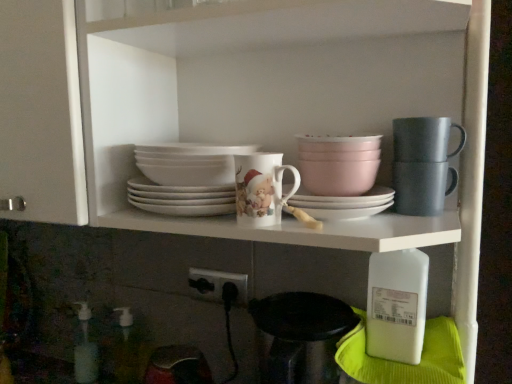
Question: From the image's perspective, would you say white matte platter at center is shown under matte gray mug at upper right, acting as the second tableware starting from the left?

Choices:
 (A) no
 (B) yes

Answer: (B)

Question: Is white matte platter at center bigger than matte gray mug at upper right, acting as the second tableware starting from the left?

Choices:
 (A) no
 (B) yes

Answer: (B)

Question: Are white matte platter at center and matte gray mug at upper right, acting as the second tableware starting from the left, located far from each other?

Choices:
 (A) yes
 (B) no

Answer: (B)

Question: Is white matte platter at center oriented away from matte gray mug at upper right, acting as the second tableware starting from the left?

Choices:
 (A) yes
 (B) no

Answer: (B)

Question: Would you say matte gray mug at upper right, arranged as the first tableware when viewed from the right, is part of white matte platter at center's contents?

Choices:
 (A) no
 (B) yes

Answer: (A)

Question: Does point (x=245, y=213) appear closer or farther from the camera than point (x=454, y=170)?

Choices:
 (A) closer
 (B) farther

Answer: (A)

Question: Do you think porcelain cup at center is within matte gray mug at upper right, or outside of it?

Choices:
 (A) outside
 (B) inside

Answer: (A)

Question: From the image's perspective, relative to matte gray mug at upper right, is porcelain cup at center above or below?

Choices:
 (A) above
 (B) below

Answer: (B)

Question: In terms of height, does porcelain cup at center look taller or shorter compared to matte gray mug at upper right?

Choices:
 (A) short
 (B) tall

Answer: (B)

Question: Visually, is translucent plastic soap dispenser at lower left, which ranks as the 2th bottle in back-to-front order, positioned to the left or to the right of porcelain cup at center?

Choices:
 (A) left
 (B) right

Answer: (A)

Question: From a real-world perspective, is translucent plastic soap dispenser at lower left, which is the 2th bottle in right-to-left order, positioned above or below porcelain cup at center?

Choices:
 (A) above
 (B) below

Answer: (B)

Question: From their relative heights in the image, would you say translucent plastic soap dispenser at lower left, which is the 2th bottle in right-to-left order, is taller or shorter than porcelain cup at center?

Choices:
 (A) short
 (B) tall

Answer: (B)

Question: Relative to porcelain cup at center, is translucent plastic soap dispenser at lower left, which is the 2th bottle in right-to-left order, in front or behind?

Choices:
 (A) behind
 (B) front

Answer: (A)

Question: From a real-world perspective, is white matte platter at center positioned above or below translucent plastic soap dispenser at lower left, marked as the second bottle in a front-to-back arrangement?

Choices:
 (A) above
 (B) below

Answer: (A)

Question: Considering the positions of white matte platter at center and translucent plastic soap dispenser at lower left, which is the 2th bottle in right-to-left order, in the image, is white matte platter at center bigger or smaller than translucent plastic soap dispenser at lower left, which is the 2th bottle in right-to-left order,?

Choices:
 (A) small
 (B) big

Answer: (B)